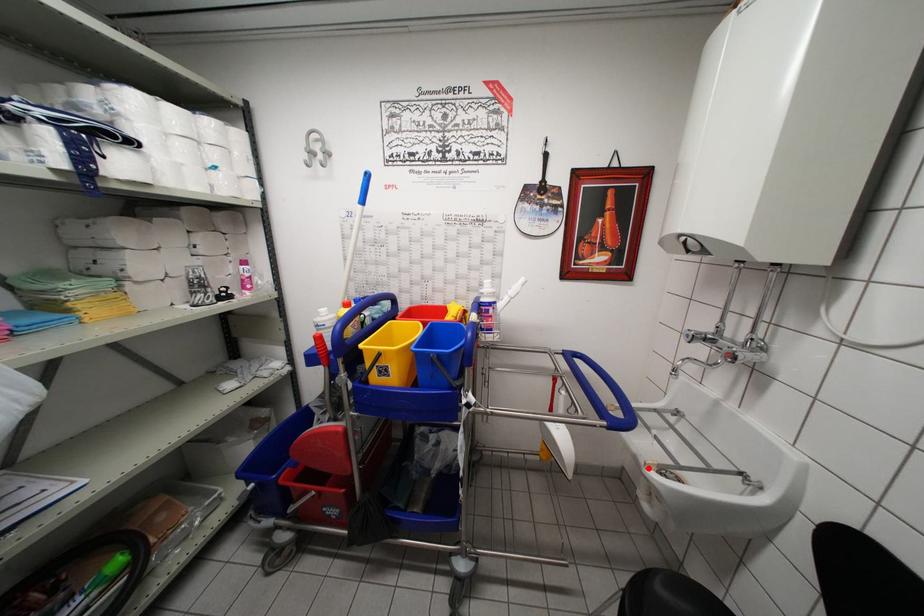
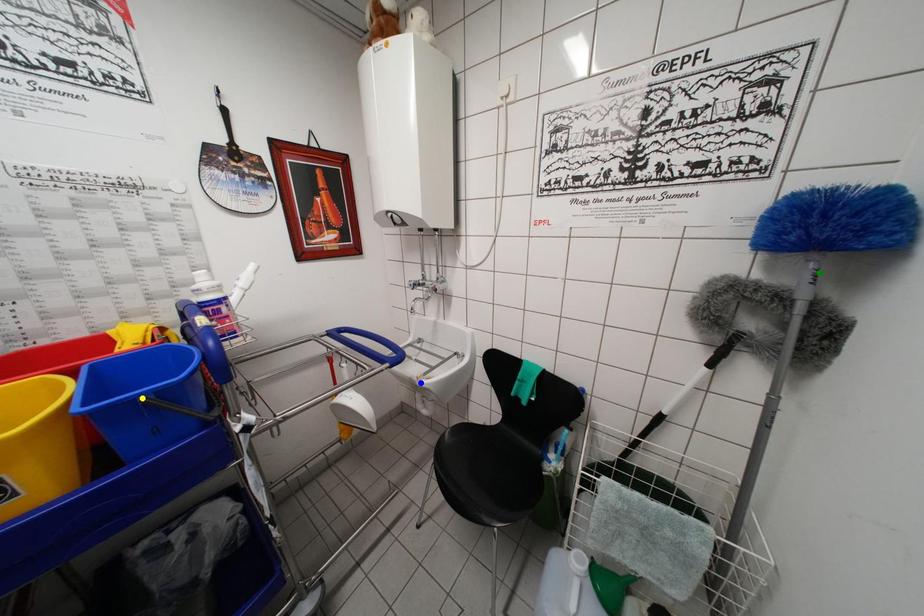
Question: I am providing you with two images of the same scene from different viewpoints. A red point is marked on the first image. You are given multiple points on the second image. Can you choose the point in image 2 that corresponds to the point in image 1?

Choices:
 (A) green point
 (B) yellow point
 (C) blue point

Answer: (C)